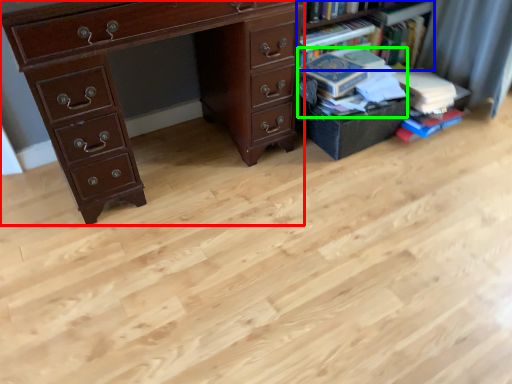
Question: Considering the real-world distances, which object is closest to chest of drawers (highlighted by a red box)? bookcase (highlighted by a blue box) or book (highlighted by a green box).

Choices:
 (A) bookcase
 (B) book

Answer: (B)